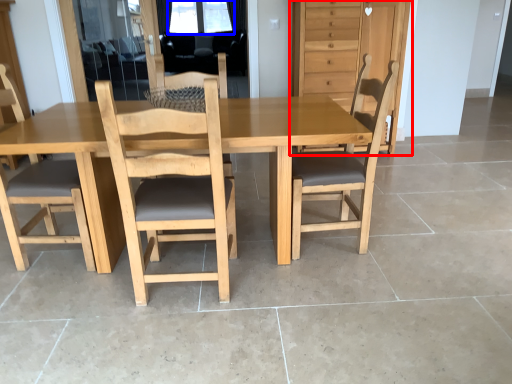
Question: Which point is further to the camera, dresser (highlighted by a red box) or window screen (highlighted by a blue box)?

Choices:
 (A) dresser
 (B) window screen

Answer: (B)